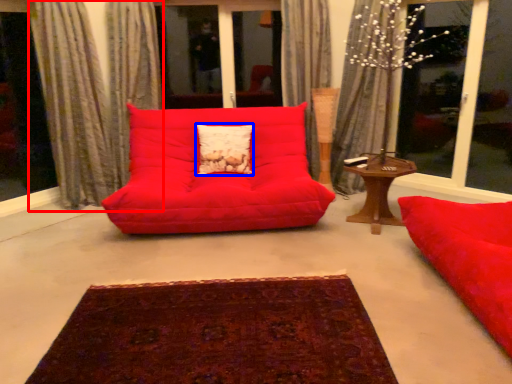
Question: Which point is closer to the camera, curtain (highlighted by a red box) or pillow (highlighted by a blue box)?

Choices:
 (A) curtain
 (B) pillow

Answer: (A)